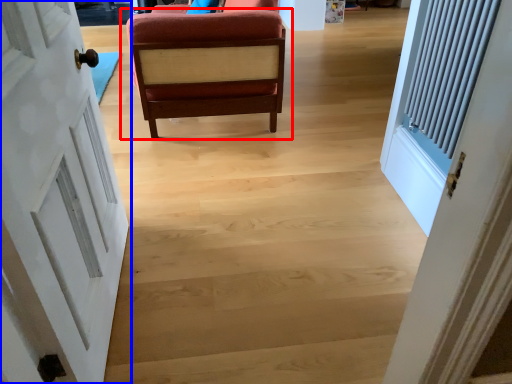
Question: Which of the following is the closest to the observer, chair (highlighted by a red box) or door (highlighted by a blue box)?

Choices:
 (A) chair
 (B) door

Answer: (B)